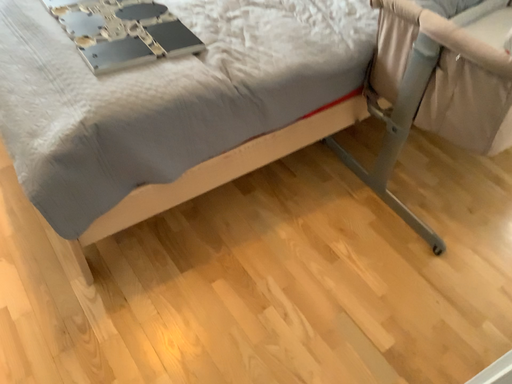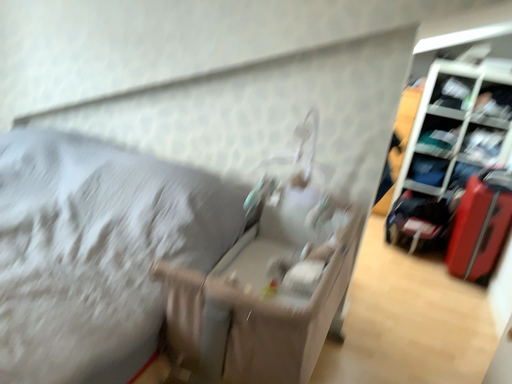
Question: How did the camera likely rotate when shooting the video?

Choices:
 (A) rotated upward
 (B) rotated downward

Answer: (A)